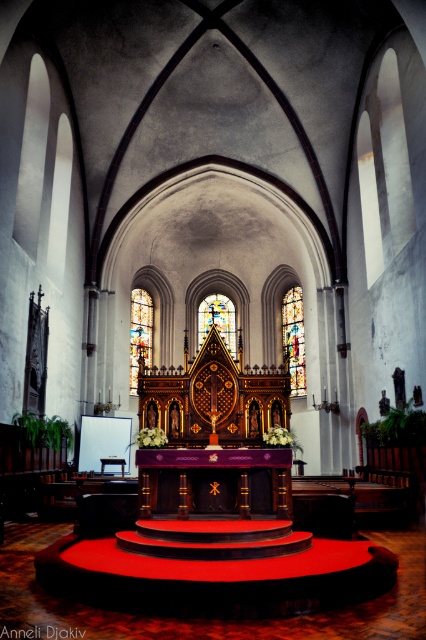
Question: Which point is closer to the camera taking this photo?

Choices:
 (A) (132, 349)
 (B) (302, 388)
 (C) (218, 323)

Answer: (B)

Question: Among these objects, which one is farthest from the camera?

Choices:
 (A) stained glass at upper center
 (B) stained glass at center
 (C) stained glass window at center

Answer: (B)

Question: Considering the relative positions of stained glass at upper center and stained glass window at center in the image provided, where is stained glass at upper center located with respect to stained glass window at center?

Choices:
 (A) below
 (B) above

Answer: (B)

Question: Observing the image, what is the correct spatial positioning of stained glass at upper center in reference to stained glass window at center?

Choices:
 (A) left
 (B) right

Answer: (B)

Question: Can you confirm if stained glass at center is bigger than stained glass window at center?

Choices:
 (A) yes
 (B) no

Answer: (B)

Question: Considering the real-world distances, which object is closest to the stained glass at upper center?

Choices:
 (A) stained glass window at center
 (B) stained glass at center

Answer: (A)